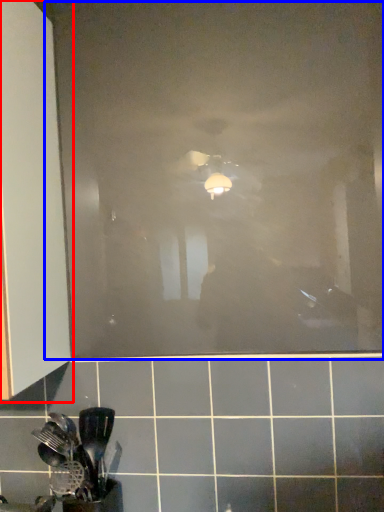
Question: Which point is closer to the camera, cabinetry (highlighted by a red box) or glass door (highlighted by a blue box)?

Choices:
 (A) cabinetry
 (B) glass door

Answer: (A)